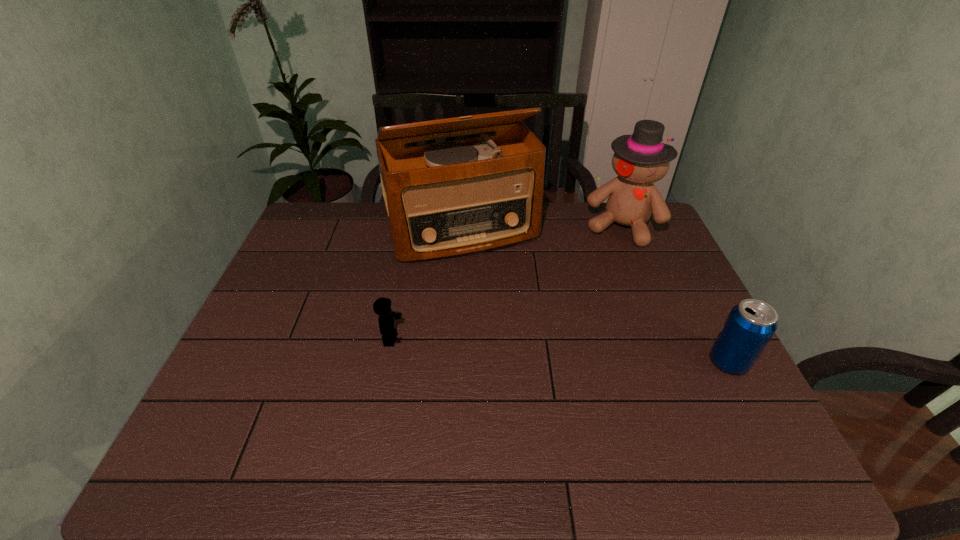
Locate an element on the screen. The height and width of the screenshot is (540, 960). free space at the right edge of the desktop is located at coordinates [675, 256].

Identify the location of vacant area at the far left corner of the desktop. (337, 208).

In the image, there is a desktop. At what (x,y) coordinates should I click in order to perform the action: click on free space at the near left corner. Please return your answer as a coordinate pair (x, y). Looking at the image, I should click on click(227, 419).

Locate an element on the screen. The height and width of the screenshot is (540, 960). unoccupied position between the third shortest object and the pop soda is located at coordinates (675, 294).

Identify the location of empty space between the shortest object and the tallest object. (427, 285).

Where is `vacant area between the third tallest object and the rag_doll`? vacant area between the third tallest object and the rag_doll is located at coordinates (675, 294).

The image size is (960, 540). Find the location of `blank region between the rag_doll and the Lego`. blank region between the rag_doll and the Lego is located at coordinates (506, 283).

Identify the location of free area in between the Lego and the rag_doll. point(506,283).

I want to click on vacant area between the tallest object and the third shortest object, so click(541, 229).

Identify the location of free spot between the pop soda and the rag_doll. (675, 294).